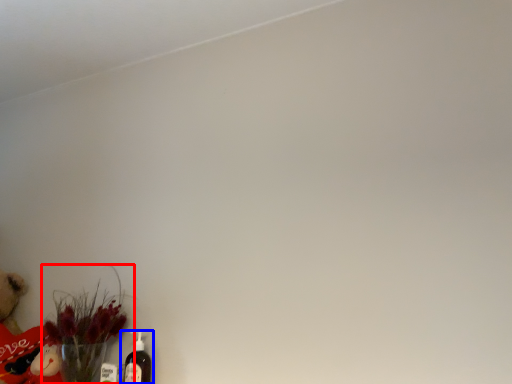
Question: Which object is further to the camera taking this photo, floral arrangement (highlighted by a red box) or bottle (highlighted by a blue box)?

Choices:
 (A) floral arrangement
 (B) bottle

Answer: (B)